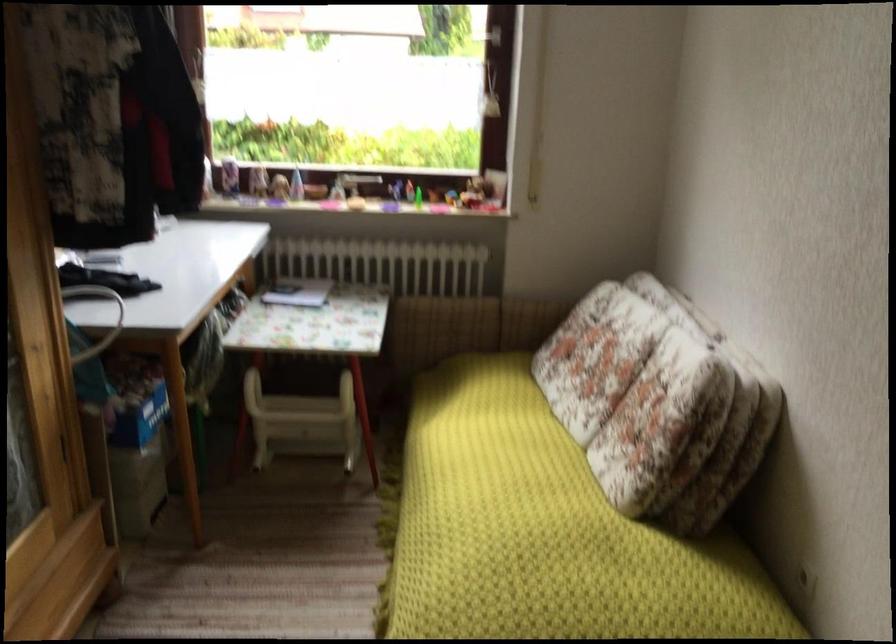
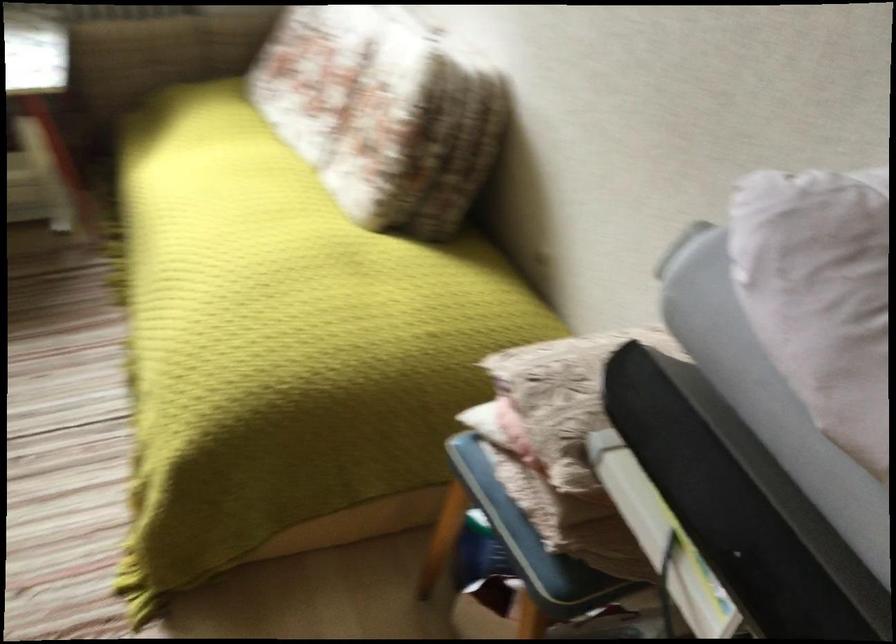
Where in the second image is the point corresponding to [660,406] from the first image?

(382, 114)